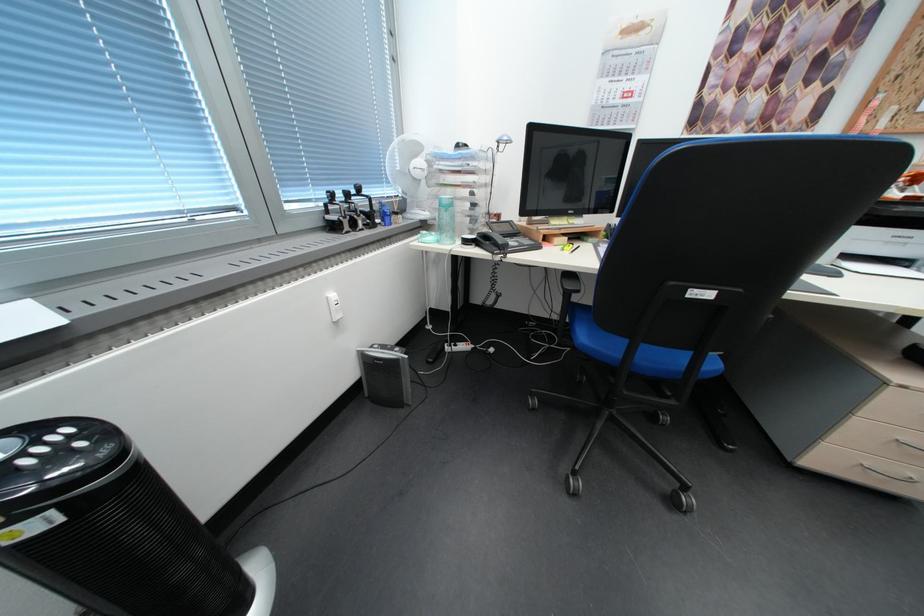
What do you see at coordinates (8, 445) in the screenshot? I see `a air purifier buttons` at bounding box center [8, 445].